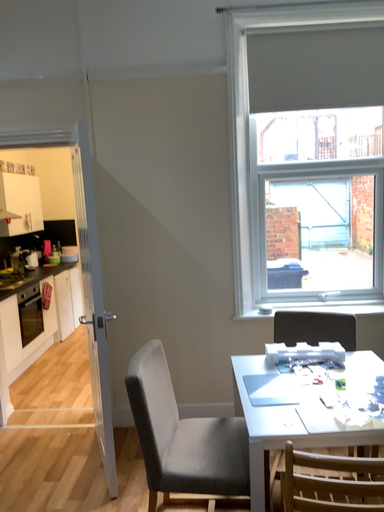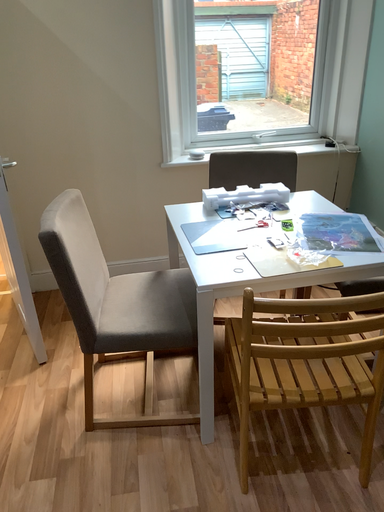
Question: Which way did the camera rotate in the video?

Choices:
 (A) rotated upward
 (B) rotated downward

Answer: (B)